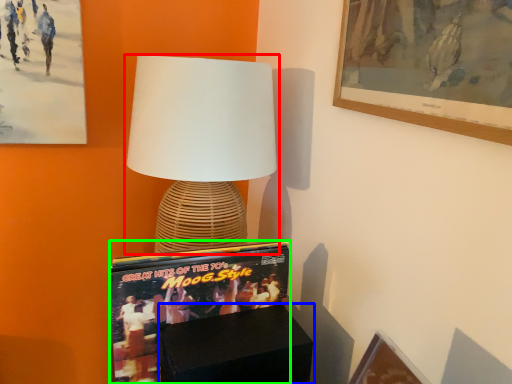
Question: Which is farther away from lamp (highlighted by a red box)? furniture (highlighted by a blue box) or magazine (highlighted by a green box)?

Choices:
 (A) furniture
 (B) magazine

Answer: (A)